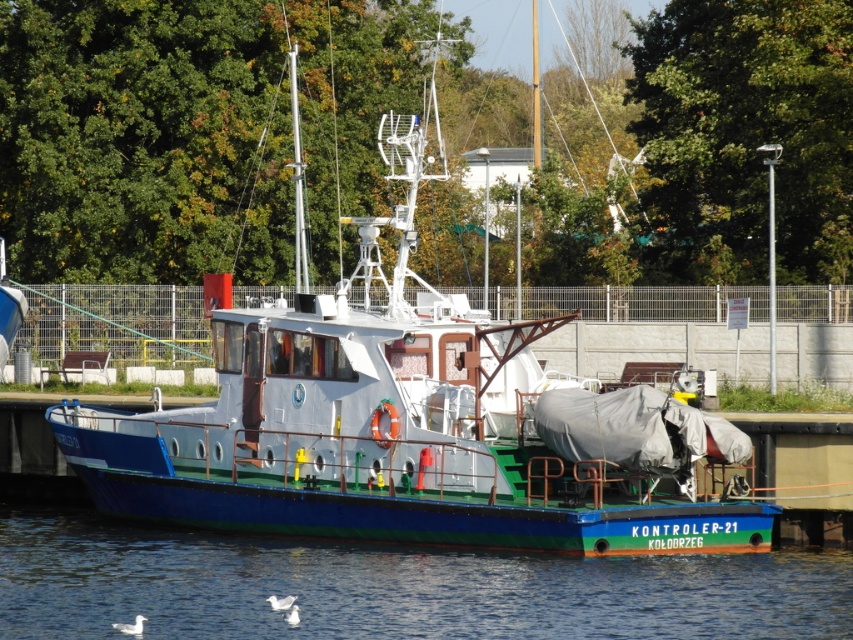
Question: Does blue matte boat at center have a larger size compared to blue glossy water at lower center?

Choices:
 (A) yes
 (B) no

Answer: (A)

Question: Is blue matte boat at center to the left of blue glossy water at lower center from the viewer's perspective?

Choices:
 (A) no
 (B) yes

Answer: (A)

Question: Which of the following is the farthest from the observer?

Choices:
 (A) (115, 528)
 (B) (245, 310)

Answer: (A)

Question: Among these objects, which one is nearest to the camera?

Choices:
 (A) blue matte boat at center
 (B) blue glossy water at lower center

Answer: (B)

Question: Is blue matte boat at center wider than blue glossy water at lower center?

Choices:
 (A) yes
 (B) no

Answer: (B)